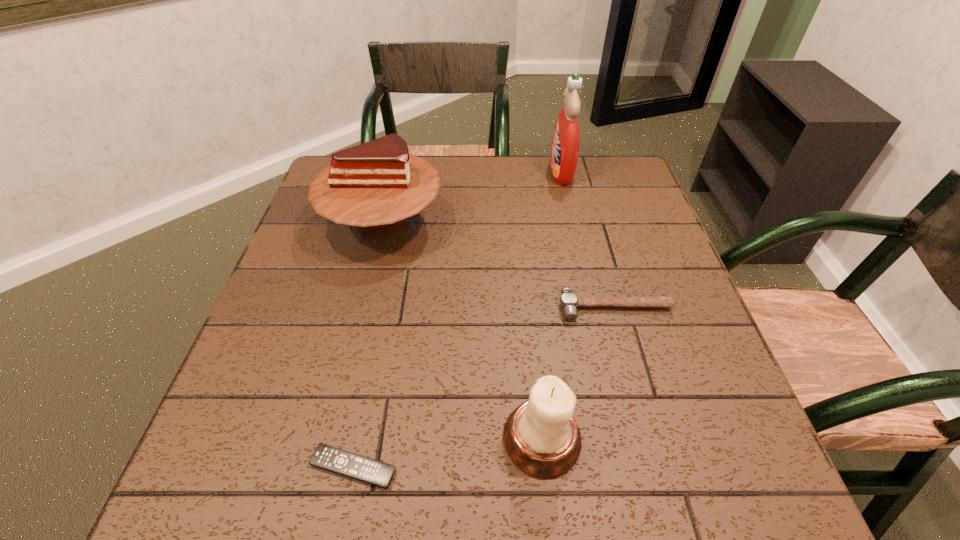
Locate an element on the screen. The height and width of the screenshot is (540, 960). free space located on the front surface of the tallest object is located at coordinates (482, 172).

You are a GUI agent. You are given a task and a screenshot of the screen. Output one action in this format:
    pyautogui.click(x=<x>, y=<y>)
    Task: Click on the free location located 0.110m on the front surface of the tallest object
    Image resolution: width=960 pixels, height=540 pixels.
    Given the screenshot: What is the action you would take?
    pyautogui.click(x=513, y=172)

This screenshot has height=540, width=960. Identify the location of blank area located on the right of the fourth shortest object. (552, 224).

At what (x,y) coordinates should I click in order to perform the action: click on free location located on the left of the third shortest object. Please return your answer as a coordinate pair (x, y). Looking at the image, I should click on (337, 439).

Identify the location of blank space located 0.200m on the striking face of the third nearest object. The image size is (960, 540). (643, 411).

The width and height of the screenshot is (960, 540). I want to click on free location located 0.090m on the left of the remote control, so click(x=254, y=467).

Locate an element on the screen. The width and height of the screenshot is (960, 540). detergent present at the far edge is located at coordinates (566, 138).

This screenshot has height=540, width=960. In order to click on cake that is positioned at the far edge in this screenshot , I will do `click(375, 186)`.

Find the location of `candle holder that is at the near edge`. candle holder that is at the near edge is located at coordinates tap(541, 437).

You are a GUI agent. You are given a task and a screenshot of the screen. Output one action in this format:
    pyautogui.click(x=<x>, y=<y>)
    Task: Click on the remote control present at the near edge
    The width and height of the screenshot is (960, 540).
    Given the screenshot: What is the action you would take?
    pyautogui.click(x=349, y=464)